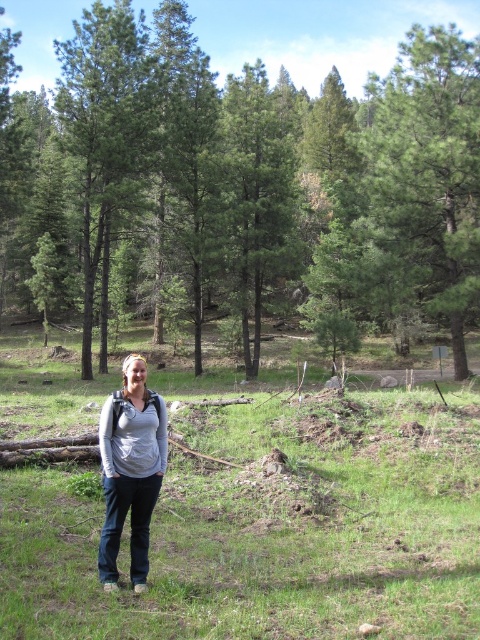
You are a hiker trying to determine which object in the scene is bigger between the green matte trees at center and the green grass at center. Based on the description, which one is larger?

The green matte trees at center are larger in size than the green grass at center.

You are a hiker navigating through the forest and want to determine which of the two points, point [63,140] or point [69,630], is closer to you. Based on the scene, which point is nearer?

Point [63,140] is closer to you because it is further to the viewer than point [69,630].

You are a hiker who wants to take a photo of the green grass at center without the green matte trees at center blocking the view. How can you adjust your position to achieve this?

Since the green matte trees at center are much taller than the green grass at center, you can move closer to the green grass at center and crouch down to frame the shot so the trees are out of the camera view.